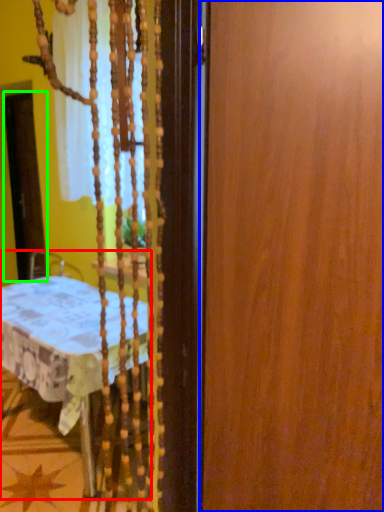
Question: Based on their relative distances, which object is nearer to furniture (highlighted by a red box)? Choose from barn door (highlighted by a blue box) and screen door (highlighted by a green box).

Choices:
 (A) barn door
 (B) screen door

Answer: (A)